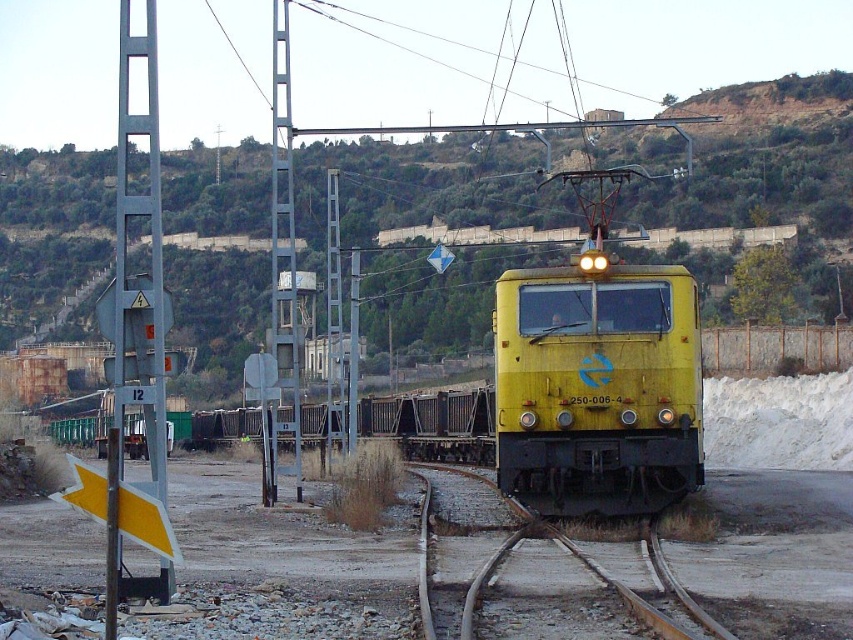
Does yellow matte train at center have a lesser height compared to yellow/yellowish metal train track at center?

Incorrect, yellow matte train at center's height does not fall short of yellow/yellowish metal train track at center's.

Is yellow matte train at center above yellow/yellowish metal train track at center?

Yes.

Where is `yellow matte train at center`? The width and height of the screenshot is (853, 640). yellow matte train at center is located at coordinates coord(596,387).

Where is `green grassy hillside at upper center`? green grassy hillside at upper center is located at coordinates (762, 161).

Which of these two, green grassy hillside at upper center or yellow matte train at center, stands shorter?

yellow matte train at center

Locate an element on the screen. Image resolution: width=853 pixels, height=640 pixels. green grassy hillside at upper center is located at coordinates (762, 161).

Is green grassy hillside at upper center positioned in front of yellow/yellowish metal train track at center?

That is False.

In the scene shown: Does green grassy hillside at upper center have a lesser width compared to yellow/yellowish metal train track at center?

Incorrect, green grassy hillside at upper center's width is not less than yellow/yellowish metal train track at center's.

Who is more distant from viewer, (755,136) or (657,579)?

Positioned behind is point (755,136).

At what (x,y) coordinates should I click in order to perform the action: click on green grassy hillside at upper center. Please return your answer as a coordinate pair (x, y). The image size is (853, 640). Looking at the image, I should click on (762, 161).